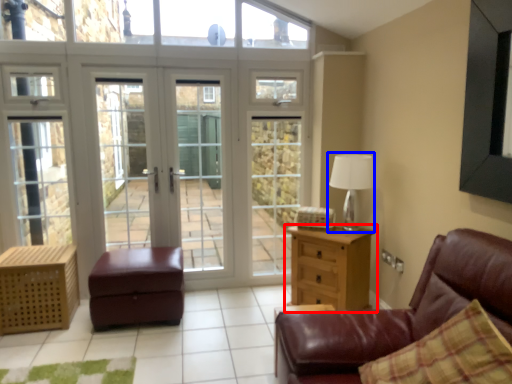
Question: Which object is further to the camera taking this photo, chest of drawers (highlighted by a red box) or table lamp (highlighted by a blue box)?

Choices:
 (A) chest of drawers
 (B) table lamp

Answer: (B)